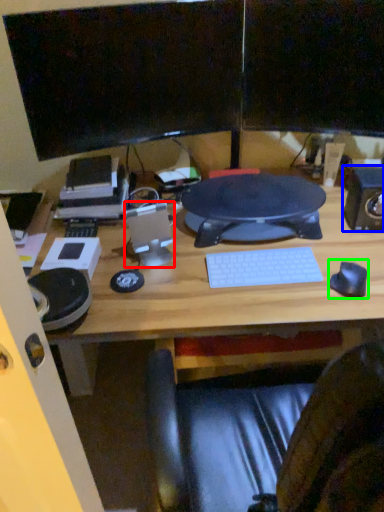
Question: Based on their relative distances, which object is nearer to speaker (highlighted by a red box)? Choose from speaker (highlighted by a blue box) and mouse (highlighted by a green box).

Choices:
 (A) speaker
 (B) mouse

Answer: (B)